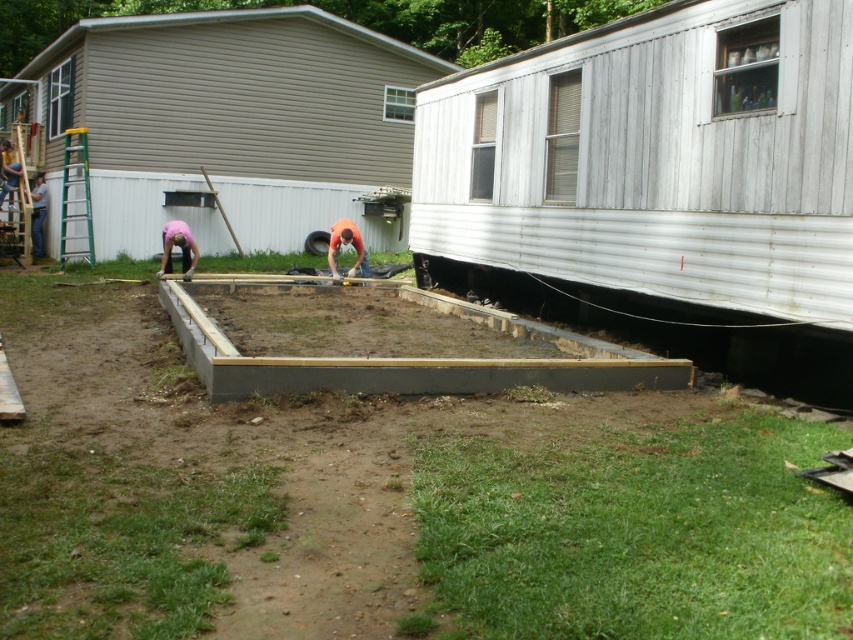
You are standing at the construction site and want to know how far the point at coordinates (548, 358) is from your current position. Can you determine the distance using the information provided?

The distance of point (548, 358) from the camera is 28.85 feet, so the point is 28.85 feet away from your current position.

You are standing at the construction site and notice the beige siding shed at upper left and the orange fabric construction worker at center. Which object is taller?

The beige siding shed at upper left is taller than the orange fabric construction worker at center.